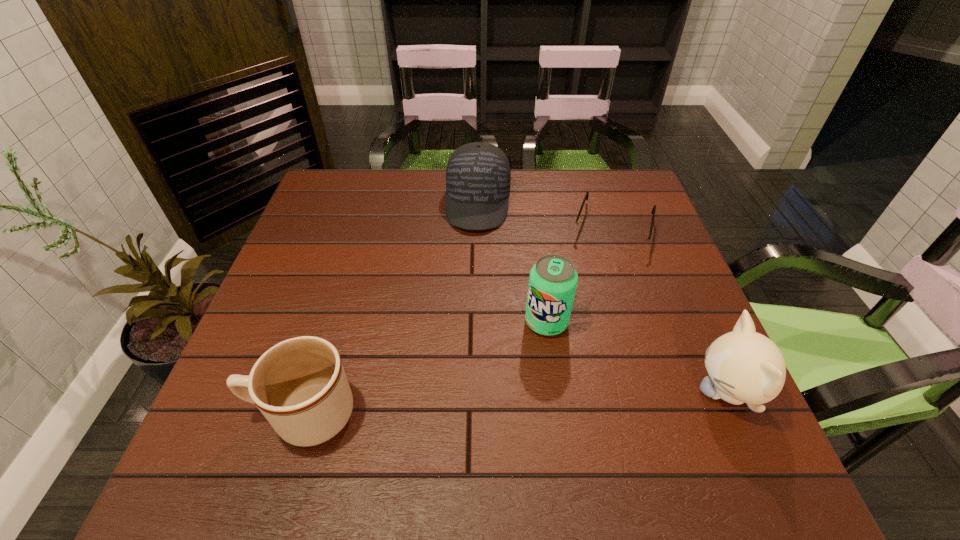
Where is `free space located 0.050m at the hinge ends of the spectacles`? The height and width of the screenshot is (540, 960). free space located 0.050m at the hinge ends of the spectacles is located at coordinates (602, 267).

At what (x,y) coordinates should I click in order to perform the action: click on blank space located 0.370m at the hinge ends of the spectacles. Please return your answer as a coordinate pair (x, y). Looking at the image, I should click on (574, 366).

Where is `vacant area located at the hinge ends of the spectacles`? The width and height of the screenshot is (960, 540). vacant area located at the hinge ends of the spectacles is located at coordinates (582, 341).

At what (x,y) coordinates should I click in order to perform the action: click on free region located 0.370m at the front of the baseball cap where the brim is located. Please return your answer as a coordinate pair (x, y). Looking at the image, I should click on (466, 342).

I want to click on vacant position located at the front of the baseball cap where the brim is located, so click(x=473, y=269).

You are a GUI agent. You are given a task and a screenshot of the screen. Output one action in this format:
    pyautogui.click(x=<x>, y=<y>)
    Task: Click on the vacant space located at the front of the baseball cap where the brim is located
    The width and height of the screenshot is (960, 540).
    Given the screenshot: What is the action you would take?
    pyautogui.click(x=474, y=253)

The height and width of the screenshot is (540, 960). What are the coordinates of `blank space located on the front-facing side of the third object from right to left` in the screenshot? It's located at (528, 379).

The height and width of the screenshot is (540, 960). In order to click on vacant region located 0.190m on the front-facing side of the third object from right to left in this screenshot , I will do `click(516, 414)`.

You are a GUI agent. You are given a task and a screenshot of the screen. Output one action in this format:
    pyautogui.click(x=<x>, y=<y>)
    Task: Click on the vacant space situated 0.170m on the front-facing side of the third object from right to left
    The image size is (960, 540).
    Given the screenshot: What is the action you would take?
    pyautogui.click(x=519, y=404)

You are a GUI agent. You are given a task and a screenshot of the screen. Output one action in this format:
    pyautogui.click(x=<x>, y=<y>)
    Task: Click on the spectacles present at the far edge
    This screenshot has height=540, width=960.
    Given the screenshot: What is the action you would take?
    pyautogui.click(x=630, y=242)